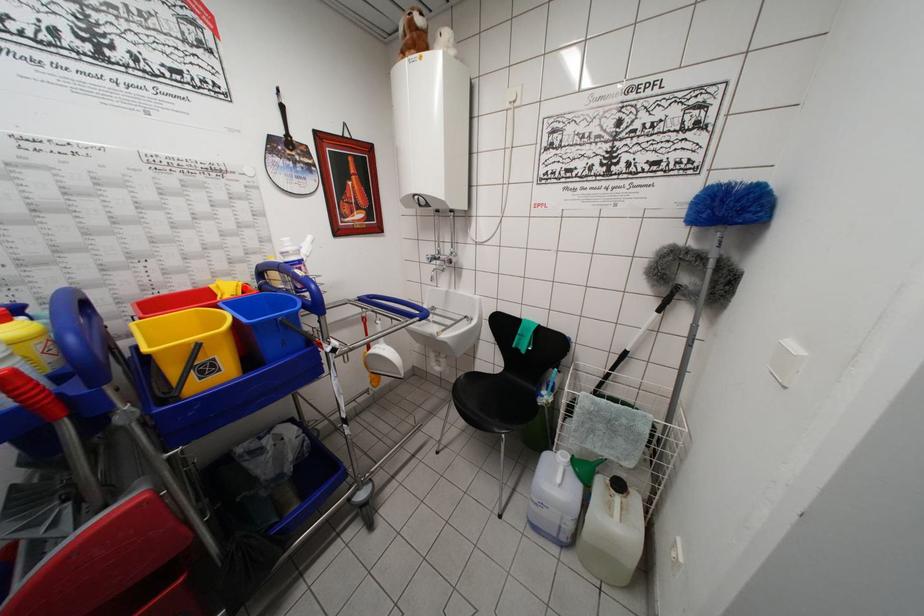
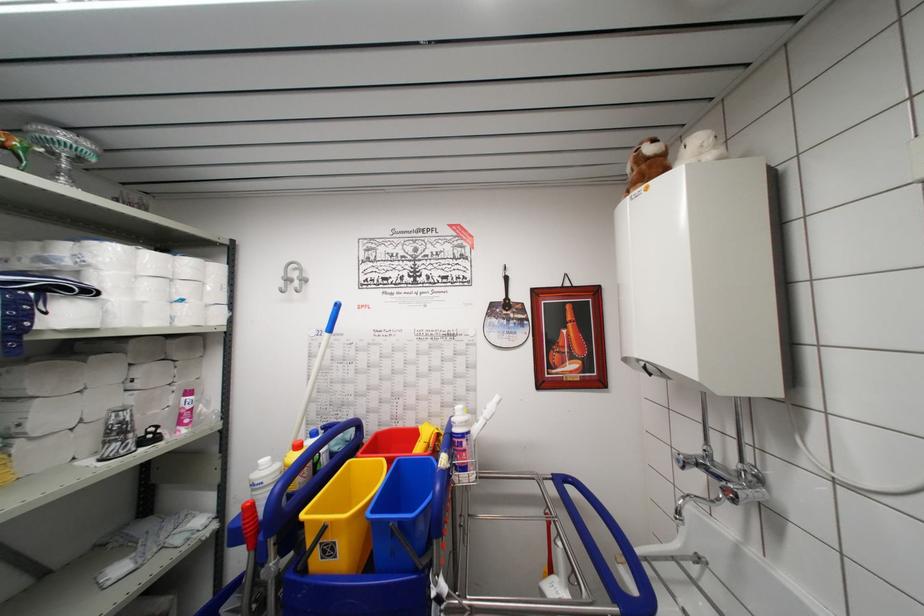
Locate, in the second image, the point that corresponds to the highlighted location in the first image.

(439, 436)